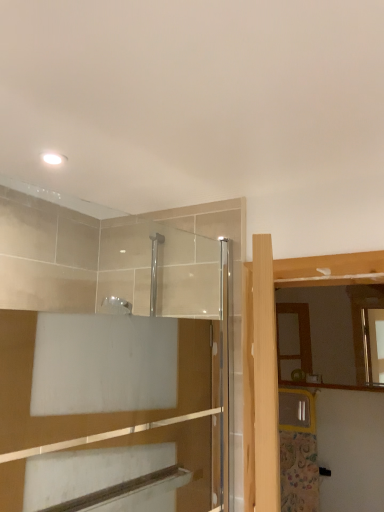
Question: Is clear glass shower door at upper center closer to the viewer compared to matte wooden mirror at right?

Choices:
 (A) no
 (B) yes

Answer: (B)

Question: Can you confirm if clear glass shower door at upper center is positioned to the left of matte wooden mirror at right?

Choices:
 (A) yes
 (B) no

Answer: (A)

Question: From a real-world perspective, is clear glass shower door at upper center under matte wooden mirror at right?

Choices:
 (A) yes
 (B) no

Answer: (A)

Question: Is clear glass shower door at upper center not inside matte wooden mirror at right?

Choices:
 (A) yes
 (B) no

Answer: (A)

Question: Is clear glass shower door at upper center looking in the opposite direction of matte wooden mirror at right?

Choices:
 (A) no
 (B) yes

Answer: (A)

Question: Is clear glass shower door at upper center aimed at matte wooden mirror at right?

Choices:
 (A) yes
 (B) no

Answer: (B)

Question: Could you tell me if matte wooden mirror at right is turned towards clear glass shower door at upper center?

Choices:
 (A) no
 (B) yes

Answer: (B)

Question: From a real-world perspective, is matte wooden mirror at right physically below clear glass shower door at upper center?

Choices:
 (A) no
 (B) yes

Answer: (A)

Question: Does matte wooden mirror at right appear on the right side of clear glass shower door at upper center?

Choices:
 (A) yes
 (B) no

Answer: (A)

Question: Can you confirm if matte wooden mirror at right is shorter than clear glass shower door at upper center?

Choices:
 (A) yes
 (B) no

Answer: (A)

Question: From the image's perspective, is matte wooden mirror at right beneath clear glass shower door at upper center?

Choices:
 (A) yes
 (B) no

Answer: (A)

Question: Is clear glass shower door at upper center a part of matte wooden mirror at right?

Choices:
 (A) no
 (B) yes

Answer: (A)

Question: Is point (223, 209) closer or farther from the camera than point (370, 366)?

Choices:
 (A) closer
 (B) farther

Answer: (A)